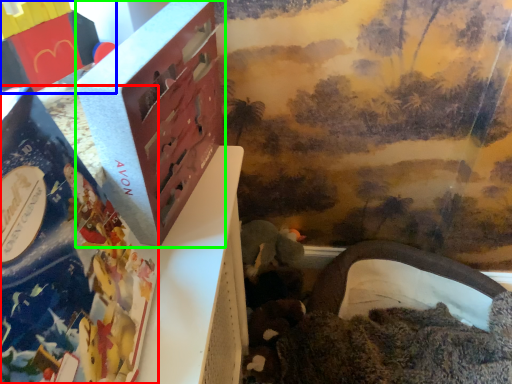
Question: Based on their relative distances, which object is farther from book (highlighted by a red box)? Choose from toy (highlighted by a blue box) and box (highlighted by a green box).

Choices:
 (A) toy
 (B) box

Answer: (A)